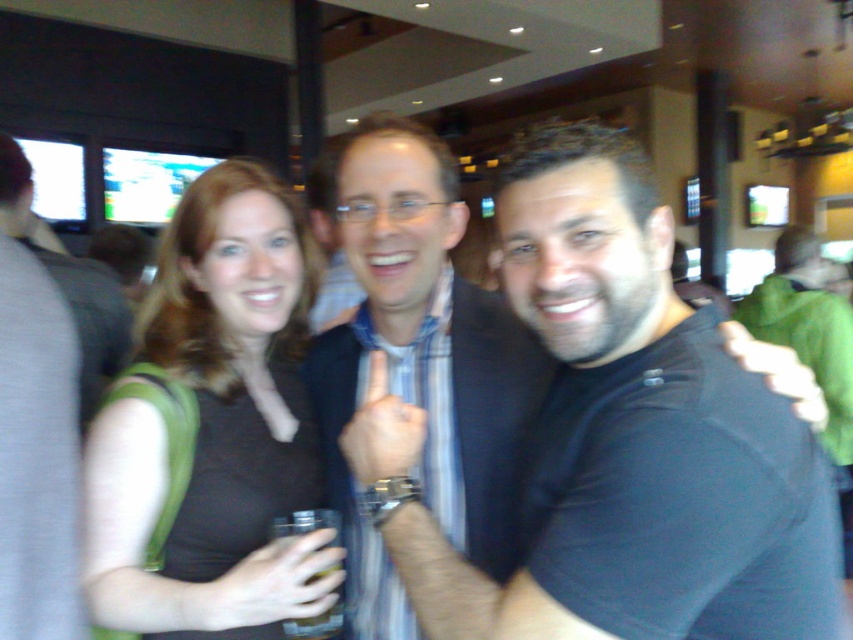
Question: Observing the image, what is the correct spatial positioning of black shirt at center in reference to matte black shirt at center?

Choices:
 (A) below
 (B) above

Answer: (B)

Question: Does black shirt at center have a smaller size compared to matte black shirt at center?

Choices:
 (A) yes
 (B) no

Answer: (B)

Question: Can you confirm if black shirt at center is wider than matte black shirt at center?

Choices:
 (A) yes
 (B) no

Answer: (A)

Question: Among these objects, which one is nearest to the camera?

Choices:
 (A) black shirt at center
 (B) matte black shirt at center

Answer: (A)

Question: Which of the following is the closest to the observer?

Choices:
 (A) (292, 300)
 (B) (740, 438)

Answer: (B)